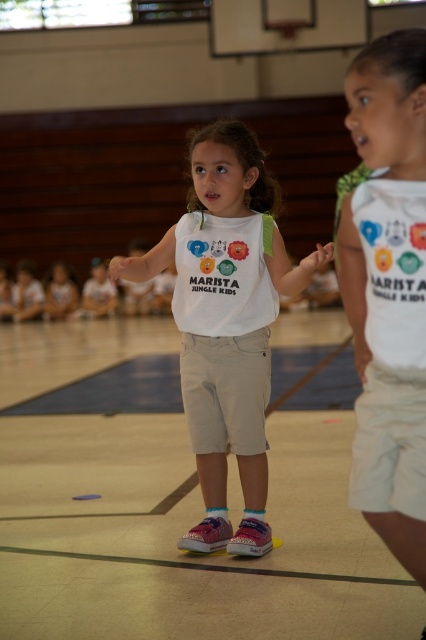
Is point (400, 58) positioned in front of point (236, 244)?

Yes, it is in front of point (236, 244).

At what (x,y) coordinates should I click in order to perform the action: click on white cotton shirt at upper right. Please return your answer as a coordinate pair (x, y). This screenshot has height=640, width=426. Looking at the image, I should click on (388, 289).

Who is more forward, (154,557) or (204,372)?

Positioned in front is point (154,557).

Is smooth beige shorts at center above white cotton shirt at center?

Actually, smooth beige shorts at center is below white cotton shirt at center.

This screenshot has width=426, height=640. I want to click on smooth beige shorts at center, so (x=181, y=532).

This screenshot has height=640, width=426. What are the coordinates of `smooth beige shorts at center` in the screenshot? It's located at (181, 532).

Is smooth beige shorts at center thinner than white cotton shirt at upper right?

No.

Which of these two, smooth beige shorts at center or white cotton shirt at upper right, stands shorter?

Standing shorter between the two is smooth beige shorts at center.

The image size is (426, 640). Identify the location of smooth beige shorts at center. (181, 532).